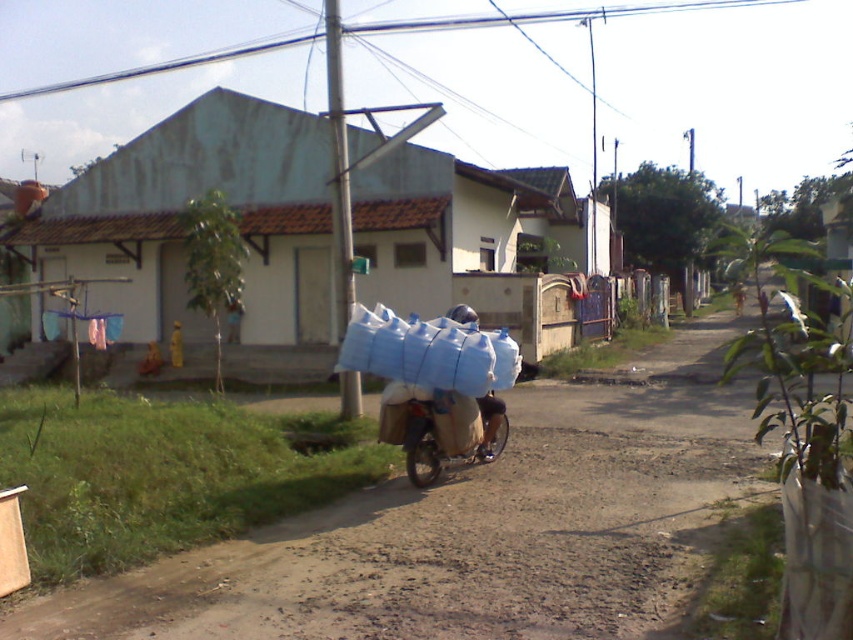
You are a delivery person who needs to deliver a package. You see a brown dirt track at center and a blue fabric bag at center. Which path should you choose to ensure your vehicle can pass safely?

The brown dirt track at center has a larger size compared to the blue fabric bag at center, so you should choose the brown dirt track at center as the path for your vehicle since it is wider and safer.

You are standing at point (476,531) in the rural street scene. What is the surface you are standing on?

The surface at point (476,531) is brown dirt track at center.